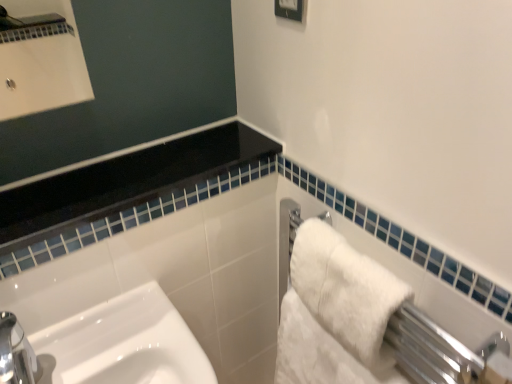
I want to click on white glossy frame at upper center, so click(x=291, y=9).

This screenshot has width=512, height=384. Describe the element at coordinates (346, 291) in the screenshot. I see `white fluffy bath towel at right, the first bath towel in the top-to-bottom sequence` at that location.

Image resolution: width=512 pixels, height=384 pixels. Find the location of `white glossy frame at upper center`. white glossy frame at upper center is located at coordinates (x=291, y=9).

Is white glossy frame at upper center taller than white fluffy bath towel at right, the second bath towel in the top-to-bottom sequence?

No, white glossy frame at upper center is not taller than white fluffy bath towel at right, the second bath towel in the top-to-bottom sequence.

Which is behind, point (279, 3) or point (276, 362)?

The point (276, 362) is farther.

Considering the relative sizes of white glossy frame at upper center and white fluffy bath towel at right, the second bath towel in the top-to-bottom sequence, in the image provided, is white glossy frame at upper center bigger than white fluffy bath towel at right, the second bath towel in the top-to-bottom sequence,?

Actually, white glossy frame at upper center might be smaller than white fluffy bath towel at right, the second bath towel in the top-to-bottom sequence.

From a real-world perspective, does white glossy frame at upper center stand above white fluffy bath towel at right, arranged as the 1th bath towel when ordered from the bottom?

Correct, in the physical world, white glossy frame at upper center is higher than white fluffy bath towel at right, arranged as the 1th bath towel when ordered from the bottom.

Considering the positions of point (291, 4) and point (306, 252), is point (291, 4) closer or farther from the camera than point (306, 252)?

Point (291, 4) appears to be closer to the viewer than point (306, 252).

Based on the photo, from a real-world perspective, is white glossy frame at upper center on white fluffy bath towel at right, which is counted as the 2th bath towel, starting from the bottom?

Yes, from a real-world perspective, white glossy frame at upper center is on top of white fluffy bath towel at right, which is counted as the 2th bath towel, starting from the bottom.

Starting from the white glossy frame at upper center, which bath towel is the 2nd one to the right? Please provide its 2D coordinates.

[(346, 291)]

From the image's perspective, is white glossy frame at upper center on top of white fluffy bath towel at right, which is counted as the 2th bath towel, starting from the bottom?

Indeed, from the image's perspective, white glossy frame at upper center is shown above white fluffy bath towel at right, which is counted as the 2th bath towel, starting from the bottom.

Which is behind, white fluffy bath towel at right, the second bath towel in the top-to-bottom sequence, or white glossy frame at upper center?

white fluffy bath towel at right, the second bath towel in the top-to-bottom sequence, is further away from the camera.

Image resolution: width=512 pixels, height=384 pixels. In order to click on bath towel that is behind the white glossy frame at upper center in this screenshot , I will do tap(322, 352).

Would you say white fluffy bath towel at right, arranged as the 1th bath towel when ordered from the bottom, is outside white glossy frame at upper center?

Yes.

Is white fluffy bath towel at right, the first bath towel in the top-to-bottom sequence, wider or thinner than white fluffy bath towel at right, arranged as the 1th bath towel when ordered from the bottom?

Clearly, white fluffy bath towel at right, the first bath towel in the top-to-bottom sequence, has less width compared to white fluffy bath towel at right, arranged as the 1th bath towel when ordered from the bottom.

Looking at this image, does white fluffy bath towel at right, which is counted as the 2th bath towel, starting from the bottom, come behind white fluffy bath towel at right, the second bath towel in the top-to-bottom sequence?

No.

Considering the sizes of objects white fluffy bath towel at right, the first bath towel in the top-to-bottom sequence, and white fluffy bath towel at right, arranged as the 1th bath towel when ordered from the bottom, in the image provided, who is bigger, white fluffy bath towel at right, the first bath towel in the top-to-bottom sequence, or white fluffy bath towel at right, arranged as the 1th bath towel when ordered from the bottom,?

white fluffy bath towel at right, arranged as the 1th bath towel when ordered from the bottom.

Can you tell me how much white fluffy bath towel at right, the first bath towel in the top-to-bottom sequence, and white fluffy bath towel at right, the second bath towel in the top-to-bottom sequence, differ in facing direction?

0.00471 degrees separate the facing orientations of white fluffy bath towel at right, the first bath towel in the top-to-bottom sequence, and white fluffy bath towel at right, the second bath towel in the top-to-bottom sequence.

Is white fluffy bath towel at right, which is counted as the 2th bath towel, starting from the bottom, positioned far away from white glossy frame at upper center?

white fluffy bath towel at right, which is counted as the 2th bath towel, starting from the bottom, is actually quite close to white glossy frame at upper center.

Is white glossy frame at upper center at the back of white fluffy bath towel at right, the first bath towel in the top-to-bottom sequence?

No, white fluffy bath towel at right, the first bath towel in the top-to-bottom sequence, is not facing away from white glossy frame at upper center.

Considering the relative positions of white fluffy bath towel at right, the first bath towel in the top-to-bottom sequence, and white glossy frame at upper center in the image provided, is white fluffy bath towel at right, the first bath towel in the top-to-bottom sequence, to the left of white glossy frame at upper center from the viewer's perspective?

In fact, white fluffy bath towel at right, the first bath towel in the top-to-bottom sequence, is to the right of white glossy frame at upper center.

From the image's perspective, between white fluffy bath towel at right, which is counted as the 2th bath towel, starting from the bottom, and white glossy frame at upper center, who is located below?

From the image's view, white fluffy bath towel at right, which is counted as the 2th bath towel, starting from the bottom, is below.

Who is smaller, white fluffy bath towel at right, the second bath towel in the top-to-bottom sequence, or white fluffy bath towel at right, which is counted as the 2th bath towel, starting from the bottom?

Smaller between the two is white fluffy bath towel at right, which is counted as the 2th bath towel, starting from the bottom.

From the image's perspective, is white fluffy bath towel at right, the second bath towel in the top-to-bottom sequence, located above or below white fluffy bath towel at right, which is counted as the 2th bath towel, starting from the bottom?

From the image's perspective, white fluffy bath towel at right, the second bath towel in the top-to-bottom sequence, appears below white fluffy bath towel at right, which is counted as the 2th bath towel, starting from the bottom.

In terms of height, does white fluffy bath towel at right, arranged as the 1th bath towel when ordered from the bottom, look taller or shorter compared to white fluffy bath towel at right, which is counted as the 2th bath towel, starting from the bottom?

Clearly, white fluffy bath towel at right, arranged as the 1th bath towel when ordered from the bottom, is taller compared to white fluffy bath towel at right, which is counted as the 2th bath towel, starting from the bottom.

Considering the relative sizes of white fluffy bath towel at right, the second bath towel in the top-to-bottom sequence, and white fluffy bath towel at right, the first bath towel in the top-to-bottom sequence, in the image provided, is white fluffy bath towel at right, the second bath towel in the top-to-bottom sequence, wider than white fluffy bath towel at right, the first bath towel in the top-to-bottom sequence,?

Indeed, white fluffy bath towel at right, the second bath towel in the top-to-bottom sequence, has a greater width compared to white fluffy bath towel at right, the first bath towel in the top-to-bottom sequence.

Identify the location of square to the left of white fluffy bath towel at right, the second bath towel in the top-to-bottom sequence. (291, 9).

Locate an element on the screen. bath towel in front of the white glossy frame at upper center is located at coordinates (346, 291).

When comparing their distances from white fluffy bath towel at right, the first bath towel in the top-to-bottom sequence, does white fluffy bath towel at right, the second bath towel in the top-to-bottom sequence, or white glossy frame at upper center seem closer?

white fluffy bath towel at right, the second bath towel in the top-to-bottom sequence, is positioned closer to the anchor white fluffy bath towel at right, the first bath towel in the top-to-bottom sequence.

Which object lies nearer to the anchor point white fluffy bath towel at right, arranged as the 1th bath towel when ordered from the bottom, white glossy frame at upper center or white fluffy bath towel at right, the first bath towel in the top-to-bottom sequence?

Among the two, white fluffy bath towel at right, the first bath towel in the top-to-bottom sequence, is located nearer to white fluffy bath towel at right, arranged as the 1th bath towel when ordered from the bottom.

Based on the photo, estimate the real-world distances between objects in this image. Which object is closer to white fluffy bath towel at right, the first bath towel in the top-to-bottom sequence, white glossy frame at upper center or white fluffy bath towel at right, arranged as the 1th bath towel when ordered from the bottom?

The object closer to white fluffy bath towel at right, the first bath towel in the top-to-bottom sequence, is white fluffy bath towel at right, arranged as the 1th bath towel when ordered from the bottom.

Based on their spatial positions, is white fluffy bath towel at right, which is counted as the 2th bath towel, starting from the bottom, or white fluffy bath towel at right, the second bath towel in the top-to-bottom sequence, further from white glossy frame at upper center?

The object further to white glossy frame at upper center is white fluffy bath towel at right, the second bath towel in the top-to-bottom sequence.

Which object lies nearer to the anchor point white fluffy bath towel at right, the second bath towel in the top-to-bottom sequence, white fluffy bath towel at right, the first bath towel in the top-to-bottom sequence, or white glossy frame at upper center?

white fluffy bath towel at right, the first bath towel in the top-to-bottom sequence, is positioned closer to the anchor white fluffy bath towel at right, the second bath towel in the top-to-bottom sequence.

Considering their positions, is white fluffy bath towel at right, the second bath towel in the top-to-bottom sequence, positioned further to white glossy frame at upper center than white fluffy bath towel at right, which is counted as the 2th bath towel, starting from the bottom?

white fluffy bath towel at right, the second bath towel in the top-to-bottom sequence, is further to white glossy frame at upper center.

Locate an element on the screen. The height and width of the screenshot is (384, 512). bath towel between white glossy frame at upper center and white fluffy bath towel at right, arranged as the 1th bath towel when ordered from the bottom, in the up-down direction is located at coordinates (346, 291).